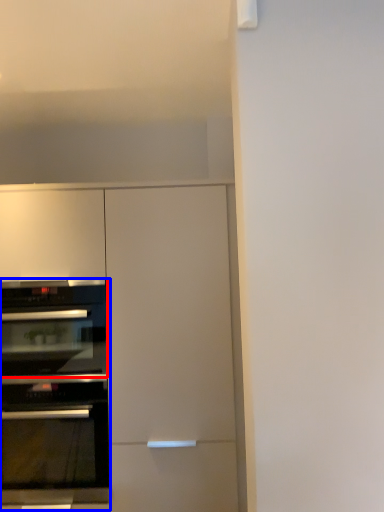
Question: Among these objects, which one is farthest to the camera, oven (highlighted by a red box) or oven (highlighted by a blue box)?

Choices:
 (A) oven
 (B) oven

Answer: (A)